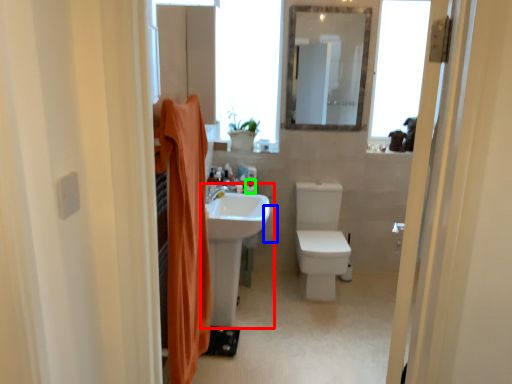
Question: Which object is the farthest from sink (highlighted by a red box)? Choose among these: toilet paper (highlighted by a blue box) or toiletry (highlighted by a green box).

Choices:
 (A) toilet paper
 (B) toiletry

Answer: (A)